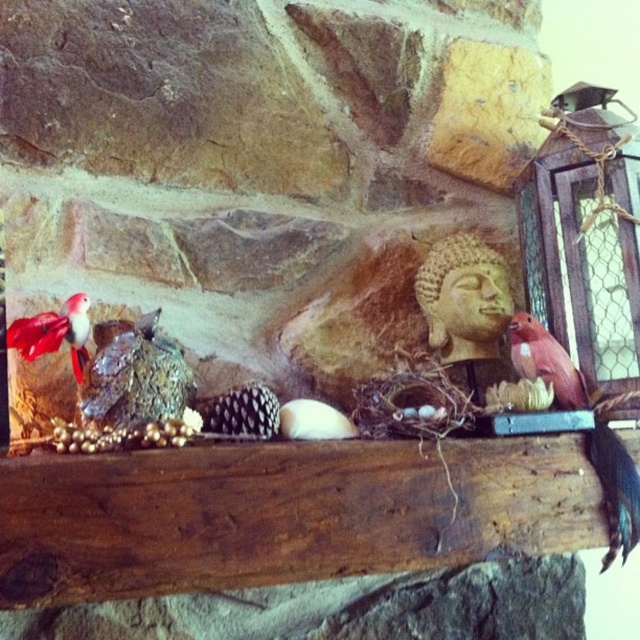
You are an interior designer assessing the mantelpiece arrangement. You notice the matte pink bird at right and the matte red bird at left. Which bird has a greater height?

The matte pink bird at right is taller than the matte red bird at left.